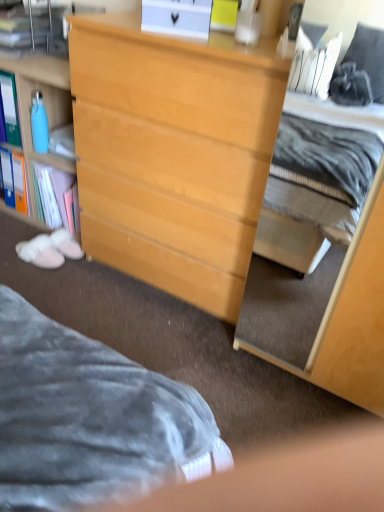
Measure the distance between point (18, 52) and camera.

The depth of point (18, 52) is 1.81 meters.

What do you see at coordinates (39, 124) in the screenshot? I see `matte blue bottle at left` at bounding box center [39, 124].

You are a GUI agent. You are given a task and a screenshot of the screen. Output one action in this format:
    pyautogui.click(x=<x>, y=<y>)
    Task: Click on the light wood cabinet at center, the second cabinetry positioned from the right
    This screenshot has height=512, width=384.
    Given the screenshot: What is the action you would take?
    pyautogui.click(x=48, y=127)

I want to click on cabinetry on the left of matte blue bottle at left, so click(x=48, y=127).

Can you confirm if matte blue bottle at left is positioned to the left of light wood cabinet at center, the second cabinetry positioned from the right?

No, matte blue bottle at left is not to the left of light wood cabinet at center, the second cabinetry positioned from the right.

Does matte blue bottle at left come behind light wood cabinet at center, which ranks as the first cabinetry in left-to-right order?

Yes, matte blue bottle at left is further from the viewer.

In terms of height, does matte blue bottle at left look taller or shorter compared to light wood cabinet at center, the second cabinetry positioned from the right?

Considering their sizes, matte blue bottle at left has less height than light wood cabinet at center, the second cabinetry positioned from the right.

Can you tell me how much light wood cabinet at center, the second cabinetry positioned from the right, and light wood dresser at center, the 1th cabinetry in the right-to-left sequence, differ in facing direction?

They differ by 2.18 degrees in their facing directions.

Who is more distant, light wood cabinet at center, the second cabinetry positioned from the right, or light wood dresser at center, the 1th cabinetry in the right-to-left sequence?

light wood cabinet at center, the second cabinetry positioned from the right, is further from the camera.

Which is farther, [67,46] or [377,202]?

The point [67,46] is farther from the camera.

The width and height of the screenshot is (384, 512). I want to click on cabinetry that appears below the light wood cabinet at center, which ranks as the first cabinetry in left-to-right order (from the image's perspective), so click(324, 271).

Is light wood dresser at center a part of matte blue bottle at left?

Actually, light wood dresser at center is outside matte blue bottle at left.

From their relative heights in the image, would you say matte blue bottle at left is taller or shorter than light wood dresser at center?

In the image, matte blue bottle at left appears to be shorter than light wood dresser at center.

Considering the points (44, 140) and (241, 237), which point is behind, point (44, 140) or point (241, 237)?

Point (44, 140)

Considering the sizes of matte blue bottle at left and light wood dresser at center in the image, is matte blue bottle at left wider or thinner than light wood dresser at center?

Clearly, matte blue bottle at left has less width compared to light wood dresser at center.

Can you confirm if light wood dresser at center, the 1th cabinetry in the right-to-left sequence, is bigger than light wood cabinet at center, which ranks as the first cabinetry in left-to-right order?

Yes.

Is light wood dresser at center, the second cabinetry from the left, surrounding light wood cabinet at center, the second cabinetry positioned from the right?

No, light wood dresser at center, the second cabinetry from the left, does not contain light wood cabinet at center, the second cabinetry positioned from the right.

Based on the photo, how much distance is there between light wood dresser at center, the 1th cabinetry in the right-to-left sequence, and light wood cabinet at center, which ranks as the first cabinetry in left-to-right order?

light wood dresser at center, the 1th cabinetry in the right-to-left sequence, and light wood cabinet at center, which ranks as the first cabinetry in left-to-right order, are 3.52 feet apart from each other.

Does light wood dresser at center, the 1th cabinetry in the right-to-left sequence, have a greater height compared to light wood dresser at center?

Yes, light wood dresser at center, the 1th cabinetry in the right-to-left sequence, is taller than light wood dresser at center.

From the image's perspective, relative to light wood dresser at center, is light wood dresser at center, the 1th cabinetry in the right-to-left sequence, above or below?

light wood dresser at center, the 1th cabinetry in the right-to-left sequence, is below light wood dresser at center.

Which of these two, light wood dresser at center, the 1th cabinetry in the right-to-left sequence, or light wood dresser at center, is wider?

light wood dresser at center, the 1th cabinetry in the right-to-left sequence, is wider.

Does light wood dresser at center, the 1th cabinetry in the right-to-left sequence, lie in front of light wood dresser at center?

Yes, light wood dresser at center, the 1th cabinetry in the right-to-left sequence, is closer to the camera.

Can you tell me how much light wood dresser at center and matte blue bottle at left differ in facing direction?

The facing directions of light wood dresser at center and matte blue bottle at left are 2.22 degrees apart.

Considering the relative sizes of light wood dresser at center and matte blue bottle at left in the image provided, is light wood dresser at center bigger than matte blue bottle at left?

Yes, light wood dresser at center is bigger than matte blue bottle at left.

Can you confirm if light wood dresser at center is thinner than matte blue bottle at left?

In fact, light wood dresser at center might be wider than matte blue bottle at left.

Which is behind, point (270, 149) or point (45, 139)?

The point (45, 139) is farther.

Considering the relative sizes of light wood dresser at center and light wood cabinet at center, the second cabinetry positioned from the right, in the image provided, is light wood dresser at center smaller than light wood cabinet at center, the second cabinetry positioned from the right,?

Actually, light wood dresser at center might be larger than light wood cabinet at center, the second cabinetry positioned from the right.

In the scene shown: From a real-world perspective, between light wood dresser at center and light wood cabinet at center, which ranks as the first cabinetry in left-to-right order, who is vertically higher?

light wood dresser at center.

Relative to light wood cabinet at center, which ranks as the first cabinetry in left-to-right order, is light wood dresser at center in front or behind?

light wood dresser at center is positioned closer to the viewer than light wood cabinet at center, which ranks as the first cabinetry in left-to-right order.

From the image's perspective, between light wood dresser at center and light wood cabinet at center, the second cabinetry positioned from the right, which one is located above?

light wood cabinet at center, the second cabinetry positioned from the right, appears higher in the image.

The height and width of the screenshot is (512, 384). Identify the location of cabinetry located underneath the matte blue bottle at left (from a real-world perspective). (48, 127).

This screenshot has width=384, height=512. I want to click on cabinetry that appears on the left of light wood dresser at center, the second cabinetry from the left, so click(48, 127).

Estimate the real-world distances between objects in this image. Which object is further from matte blue bottle at left, light wood cabinet at center, the second cabinetry positioned from the right, or light wood dresser at center, the 1th cabinetry in the right-to-left sequence?

light wood dresser at center, the 1th cabinetry in the right-to-left sequence, is further to matte blue bottle at left.

Based on their spatial positions, is light wood cabinet at center, which ranks as the first cabinetry in left-to-right order, or matte blue bottle at left further from light wood dresser at center, the 1th cabinetry in the right-to-left sequence?

matte blue bottle at left lies further to light wood dresser at center, the 1th cabinetry in the right-to-left sequence, than the other object.

Which object lies further to the anchor point light wood cabinet at center, which ranks as the first cabinetry in left-to-right order, light wood dresser at center or matte blue bottle at left?

The object further to light wood cabinet at center, which ranks as the first cabinetry in left-to-right order, is light wood dresser at center.

From the image, which object appears to be farther from matte blue bottle at left, light wood dresser at center, the 1th cabinetry in the right-to-left sequence, or light wood cabinet at center, the second cabinetry positioned from the right?

Among the two, light wood dresser at center, the 1th cabinetry in the right-to-left sequence, is located further to matte blue bottle at left.

Based on their spatial positions, is light wood dresser at center or light wood cabinet at center, which ranks as the first cabinetry in left-to-right order, closer to matte blue bottle at left?

Among the two, light wood cabinet at center, which ranks as the first cabinetry in left-to-right order, is located nearer to matte blue bottle at left.

From the image, which object appears to be nearer to light wood dresser at center, light wood cabinet at center, the second cabinetry positioned from the right, or light wood dresser at center, the 1th cabinetry in the right-to-left sequence?

light wood dresser at center, the 1th cabinetry in the right-to-left sequence, lies closer to light wood dresser at center than the other object.

Considering their positions, is light wood dresser at center, the 1th cabinetry in the right-to-left sequence, positioned closer to light wood dresser at center than light wood cabinet at center, which ranks as the first cabinetry in left-to-right order?

The object closer to light wood dresser at center is light wood dresser at center, the 1th cabinetry in the right-to-left sequence.

Estimate the real-world distances between objects in this image. Which object is closer to matte blue bottle at left, light wood dresser at center or light wood dresser at center, the 1th cabinetry in the right-to-left sequence?

Based on the image, light wood dresser at center appears to be nearer to matte blue bottle at left.

Identify the location of bottle between light wood cabinet at center, the second cabinetry positioned from the right, and light wood dresser at center from left to right. The height and width of the screenshot is (512, 384). (39, 124).

The height and width of the screenshot is (512, 384). Find the location of `desk between light wood cabinet at center, which ranks as the first cabinetry in left-to-right order, and light wood dresser at center, the second cabinetry from the left, in the horizontal direction`. desk between light wood cabinet at center, which ranks as the first cabinetry in left-to-right order, and light wood dresser at center, the second cabinetry from the left, in the horizontal direction is located at coordinates (173, 154).

Identify the location of desk between matte blue bottle at left and light wood dresser at center, the 1th cabinetry in the right-to-left sequence. (173, 154).

I want to click on bottle between light wood cabinet at center, the second cabinetry positioned from the right, and light wood dresser at center, the 1th cabinetry in the right-to-left sequence, from left to right, so click(x=39, y=124).